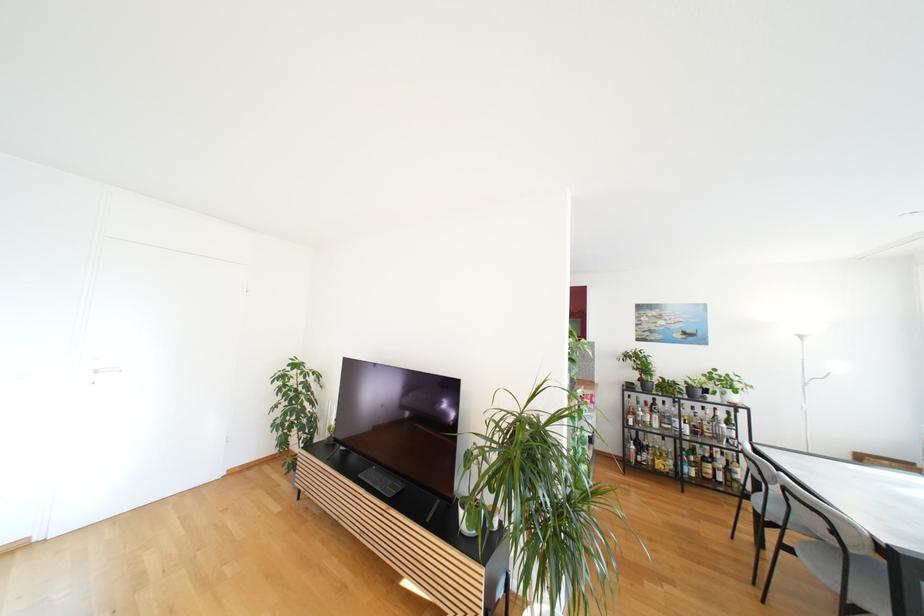
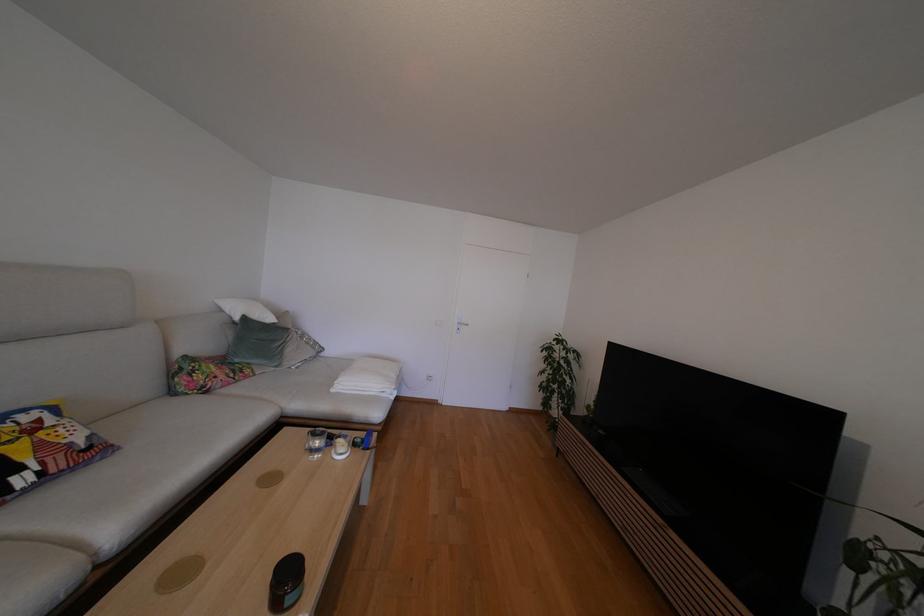
Question: The images are taken continuously from a first-person perspective. In which direction is your viewpoint rotating?

Choices:
 (A) Left
 (B) Right
 (C) Up
 (D) Down

Answer: (A)